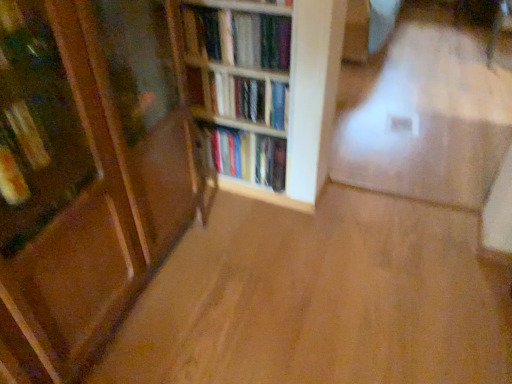
Question: Which direction should I rotate to face wooden bookshelf at center, which ranks as the first book in top-to-bottom order, — up or down?

Choices:
 (A) down
 (B) up

Answer: (B)

Question: Which direction should I rotate to face hardcover books at center, the second book in the top-to-bottom sequence, — up or down?

Choices:
 (A) up
 (B) down

Answer: (A)

Question: Is hardcover books at center, the second book in the bottom-to-top sequence, a part of hardcover books at center, which is counted as the third book, starting from the top?

Choices:
 (A) yes
 (B) no

Answer: (B)

Question: Considering the relative positions of hardcover books at center, which is counted as the third book, starting from the top, and hardcover books at center, the second book in the bottom-to-top sequence, in the image provided, is hardcover books at center, which is counted as the third book, starting from the top, to the right of hardcover books at center, the second book in the bottom-to-top sequence, from the viewer's perspective?

Choices:
 (A) yes
 (B) no

Answer: (A)

Question: From a real-world perspective, is hardcover books at center, the first book in the bottom-to-top sequence, physically below hardcover books at center, the second book in the bottom-to-top sequence?

Choices:
 (A) no
 (B) yes

Answer: (B)

Question: Is hardcover books at center, which is counted as the third book, starting from the top, oriented towards hardcover books at center, the second book in the top-to-bottom sequence?

Choices:
 (A) no
 (B) yes

Answer: (A)

Question: From the image's perspective, is hardcover books at center, which is counted as the third book, starting from the top, below hardcover books at center, the second book in the bottom-to-top sequence?

Choices:
 (A) no
 (B) yes

Answer: (B)

Question: Can you confirm if hardcover books at center, which is counted as the third book, starting from the top, is thinner than hardcover books at center, the second book in the bottom-to-top sequence?

Choices:
 (A) yes
 (B) no

Answer: (B)

Question: Does wooden bookshelf at center, marked as the third book in a bottom-to-top arrangement, have a larger size compared to hardcover books at center, the first book in the bottom-to-top sequence?

Choices:
 (A) yes
 (B) no

Answer: (B)

Question: Would you say wooden bookshelf at center, which ranks as the first book in top-to-bottom order, is outside hardcover books at center, which is counted as the third book, starting from the top?

Choices:
 (A) yes
 (B) no

Answer: (A)

Question: From the image's perspective, would you say wooden bookshelf at center, which ranks as the first book in top-to-bottom order, is shown under hardcover books at center, which is counted as the third book, starting from the top?

Choices:
 (A) yes
 (B) no

Answer: (B)

Question: Is wooden bookshelf at center, marked as the third book in a bottom-to-top arrangement, facing towards hardcover books at center, which is counted as the third book, starting from the top?

Choices:
 (A) no
 (B) yes

Answer: (A)

Question: From a real-world perspective, is wooden bookshelf at center, marked as the third book in a bottom-to-top arrangement, on hardcover books at center, which is counted as the third book, starting from the top?

Choices:
 (A) yes
 (B) no

Answer: (A)

Question: Is wooden bookshelf at center, which ranks as the first book in top-to-bottom order, at the left side of hardcover books at center, the first book in the bottom-to-top sequence?

Choices:
 (A) no
 (B) yes

Answer: (B)

Question: Considering the relative sizes of wooden bookshelf at center and hardcover books at center, the second book in the bottom-to-top sequence, in the image provided, is wooden bookshelf at center taller than hardcover books at center, the second book in the bottom-to-top sequence,?

Choices:
 (A) yes
 (B) no

Answer: (A)